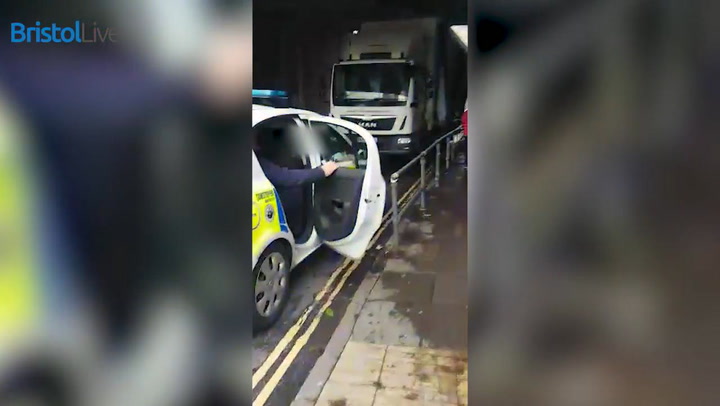
Locate an element on the screen. The image size is (720, 406). light bar is located at coordinates (261, 93).